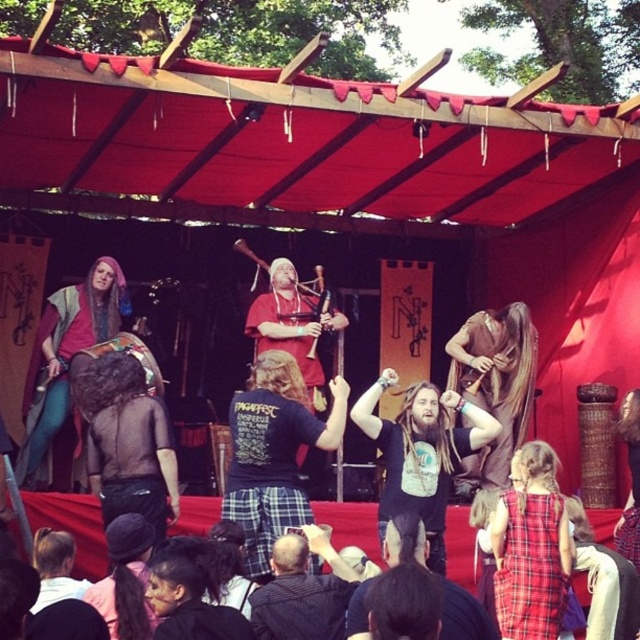
You are an audience member sitting in the front row of the performance. You notice two brown items on the central performer. Which item is positioned lower on their body, the brown textured shirt at center or the brown leather vest at center?

The brown textured shirt at center is located below the brown leather vest at center, so the brown textured shirt at center is positioned lower on their body.

You are a photographer at the event and want to capture both the brown textured shirt at center and the matte brown leather bag at left in a single frame. Given that your camera has a fixed focal length, which object should you focus on to ensure both are in focus?

You should focus on the brown textured shirt at center because it is larger in size compared to the matte brown leather bag at left, meaning it is closer to the camera. By focusing on the closer object, both subjects will be in focus.